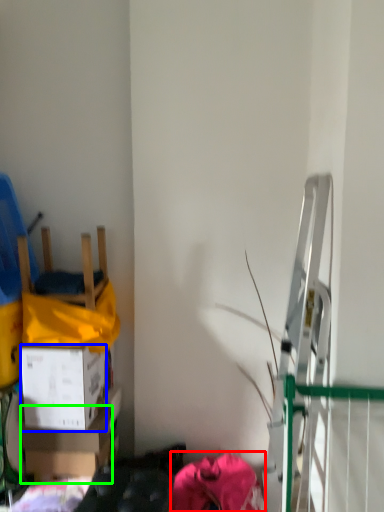
Question: Considering the real-world distances, which object is closest to clothing (highlighted by a red box)? box (highlighted by a blue box) or box (highlighted by a green box).

Choices:
 (A) box
 (B) box

Answer: (B)